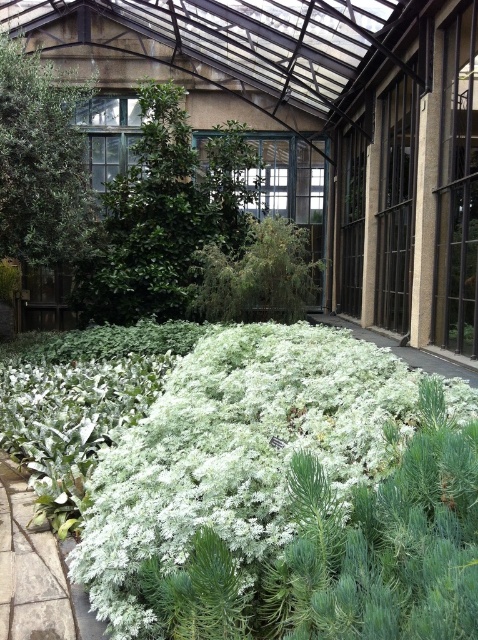
You are a gardener who wants to plant a new flower that needs full sunlight. You see the white fluffy plant at center and the green fuzzy bush at center. Which one is taller and might block the sunlight for the new flower?

The green fuzzy bush at center is taller than the white fluffy plant at center, so it might block the sunlight for the new flower.

You are a gardener standing at the entrance of the greenhouse. You need to locate the white fluffy plant at center. Based on the coordinates provided, can you determine its position relative to the entrance?

The white fluffy plant at center is located at coordinates point [265,488], which means it is positioned towards the right and slightly above the center of the greenhouse. Since the entrance is typically at the front, the plant would be to your right and a bit forward from the center point.

You are a gardener standing in the greenhouse and want to water both the white fluffy plant at center and the green fuzzy bush at center. Which plant should you water first if you want to start with the one that is closer to you?

The white fluffy plant at center is closer to the viewer than the green fuzzy bush at center, so you should water the white fluffy plant at center first.